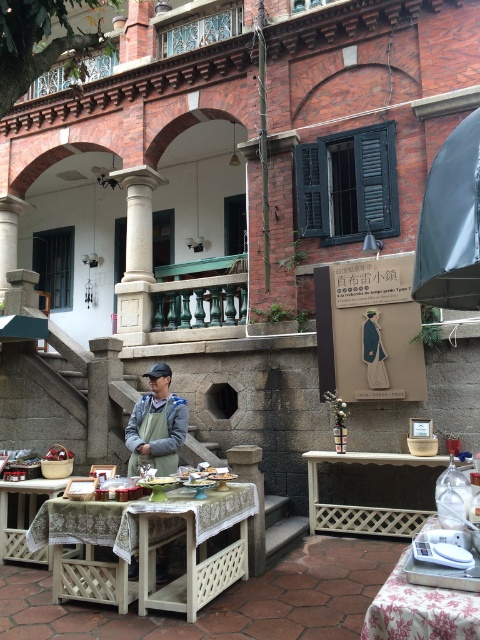
Does white lattice picnic table at center have a lesser width compared to floral fabric table at lower right?

No, white lattice picnic table at center is not thinner than floral fabric table at lower right.

Based on the photo, can you confirm if white lattice picnic table at center is smaller than floral fabric table at lower right?

No, white lattice picnic table at center is not smaller than floral fabric table at lower right.

This screenshot has width=480, height=640. I want to click on white lattice picnic table at center, so click(140, 516).

Does white lattice picnic table at center have a greater width compared to white lattice table at center?

Indeed, white lattice picnic table at center has a greater width compared to white lattice table at center.

Between white lattice picnic table at center and white lattice table at center, which one is positioned higher?

Positioned higher is white lattice picnic table at center.

Between point (67, 524) and point (320, 522), which one is positioned behind?

Positioned behind is point (320, 522).

This screenshot has width=480, height=640. Identify the location of white lattice picnic table at center. click(140, 516).

Does white lattice picnic table at center have a smaller size compared to wooden lattice table at center?

Incorrect, white lattice picnic table at center is not smaller in size than wooden lattice table at center.

Does point (35, 529) come in front of point (8, 484)?

Yes, point (35, 529) is closer to viewer.

This screenshot has height=640, width=480. I want to click on white lattice picnic table at center, so click(x=140, y=516).